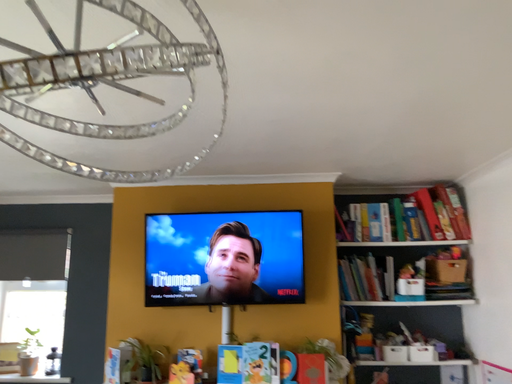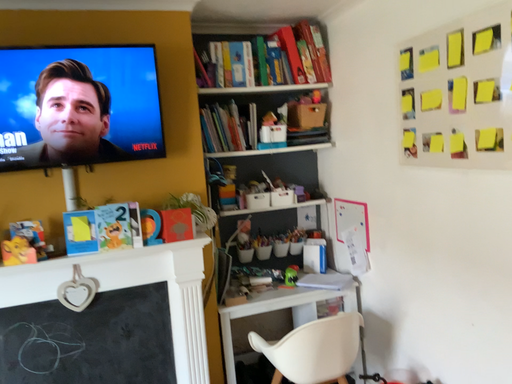
Question: How did the camera likely rotate when shooting the video?

Choices:
 (A) rotated left
 (B) rotated right

Answer: (B)